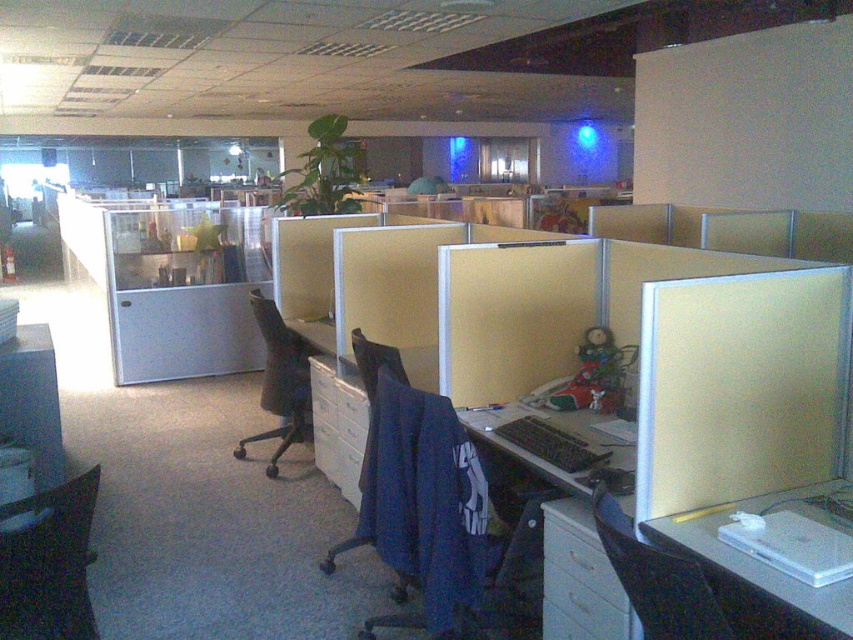
Question: Estimate the real-world distances between objects in this image. Which object is closer to the black mesh chair at center?

Choices:
 (A) blue fabric swivel chair at center
 (B) white plastic file cabinet at lower right
 (C) black fabric chair at lower right

Answer: (A)

Question: Which point is closer to the camera?

Choices:
 (A) (721, 588)
 (B) (540, 540)

Answer: (A)

Question: Can you confirm if black fabric chair at lower left is smaller than white plastic file cabinet at lower right?

Choices:
 (A) no
 (B) yes

Answer: (A)

Question: Estimate the real-world distances between objects in this image. Which object is farther from the blue fabric swivel chair at center?

Choices:
 (A) black mesh chair at center
 (B) white plastic file cabinet at lower right
 (C) black fabric chair at lower right

Answer: (C)

Question: Does blue fabric swivel chair at center have a lesser width compared to black fabric chair at lower left?

Choices:
 (A) yes
 (B) no

Answer: (B)

Question: Does blue fabric swivel chair at center have a smaller size compared to black fabric chair at lower right?

Choices:
 (A) no
 (B) yes

Answer: (A)